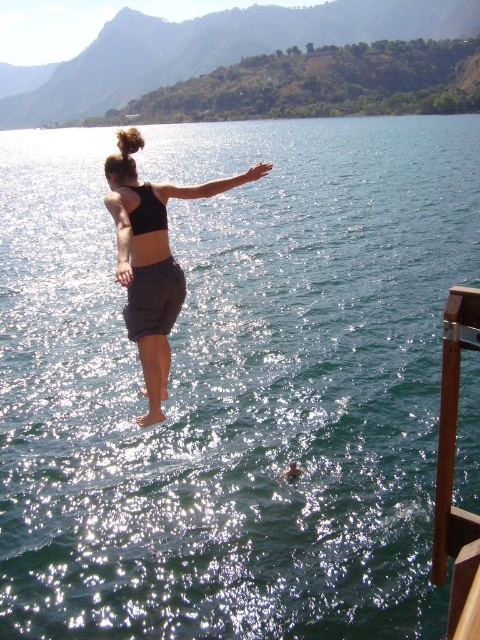
Question: Is black matte shorts at center below brown wood boat at right?

Choices:
 (A) no
 (B) yes

Answer: (A)

Question: Does brown wood boat at right have a greater width compared to black matte bikini top at center?

Choices:
 (A) no
 (B) yes

Answer: (A)

Question: Which object is farther from the camera taking this photo?

Choices:
 (A) black matte bikini top at center
 (B) black matte shorts at center
 (C) brown wood boat at right

Answer: (C)

Question: Can you confirm if brown wood boat at right is positioned below black matte bikini top at center?

Choices:
 (A) yes
 (B) no

Answer: (A)

Question: Based on their relative distances, which object is nearer to the black matte bikini top at center?

Choices:
 (A) brown wood boat at right
 (B) black matte shorts at center

Answer: (B)

Question: Among these objects, which one is nearest to the camera?

Choices:
 (A) black matte shorts at center
 (B) black matte bikini top at center
 (C) brown wood boat at right

Answer: (A)